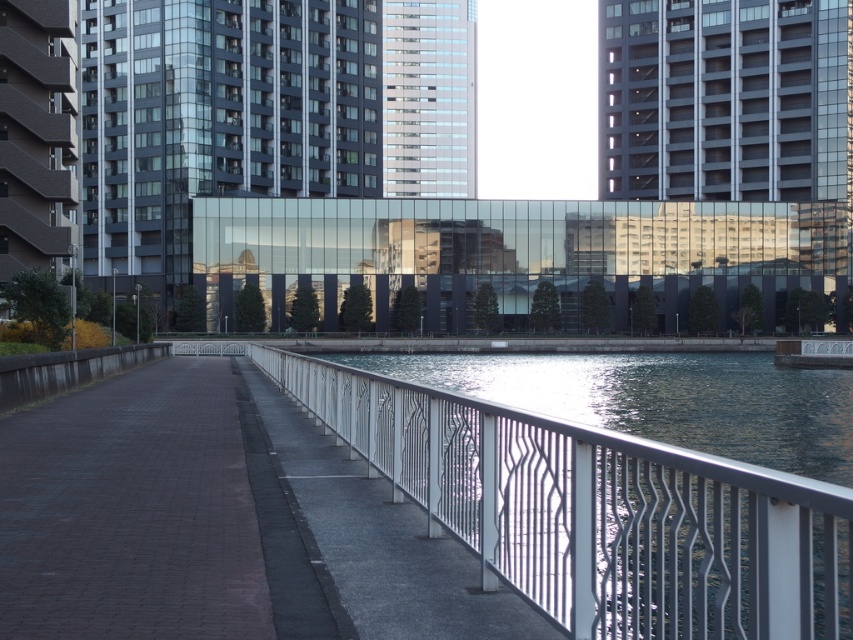
You are standing on the walkway and want to take a photo of the metallic water at center. Where should you position yourself to capture it in the frame?

The metallic water at center is located at point (598,512), so you should position yourself directly in front of it to capture it in the frame.

You are an architect designing a new sculpture to be placed between the metallic water at center and the transparent glass bridge at center. The sculpture must be shorter than both objects. Based on their heights, which object should the sculpture be placed closer to?

The sculpture should be placed closer to the metallic water at center because it is shorter than the transparent glass bridge at center, so the sculpture can be positioned near the shorter object without exceeding its height.

You are a tourist standing on the walkway and want to take a photo of the modern building with both the metallic water at center and the transparent glass bridge at center in the frame. Since you can only focus on one object, which one should you prioritize to ensure both are in the shot?

Prioritize focusing on the transparent glass bridge at center because the metallic water at center is to the left of it, so adjusting focus to the bridge will keep both objects within the frame.